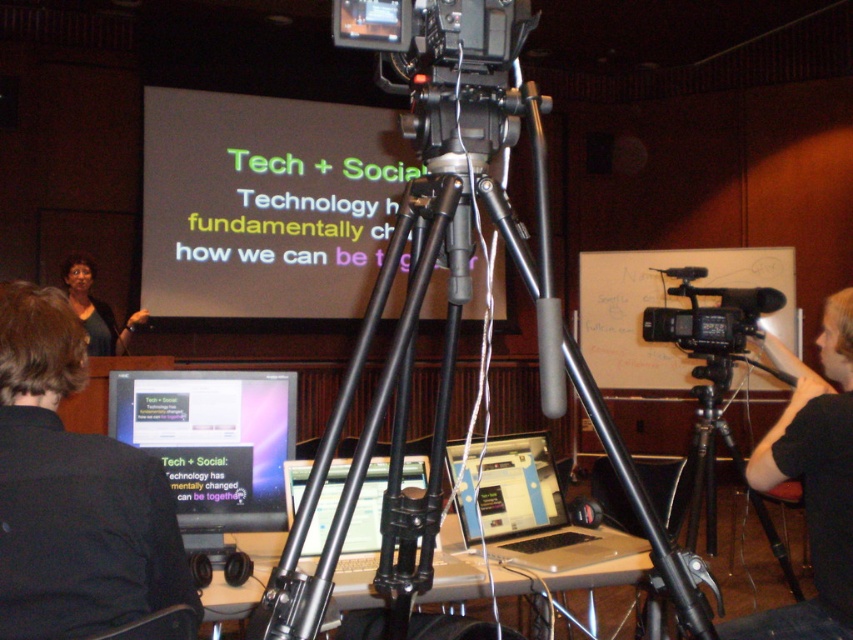
You are setting up for a presentation and need to place two laptops on a table. The beige plastic laptop at center and the white glossy laptop at center must be arranged so that the beige one is to the right of the white one. Is this arrangement possible based on the current setup?

Yes, the beige plastic laptop at center is already positioned to the right of the white glossy laptop at center, so the arrangement is possible.

You are setting up for a presentation and need to place both the beige plastic laptop at center and the white glossy laptop at center on a desk. According to the scene, which laptop should be placed lower on the desk?

The beige plastic laptop at center should be placed lower on the desk since it is located below the white glossy laptop at center in the scene.

You are setting up for a live stream and need to adjust the black plastic video camera at center so it can focus on the white glossy laptop at center. Is the laptop currently in the camera frame?

The white glossy laptop at center is positioned under the black plastic video camera at center, so the camera is likely pointing downward and can capture the laptop in its frame.